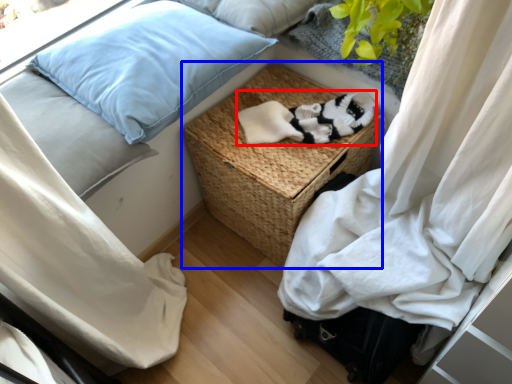
Question: Among these objects, which one is farthest to the camera, clothing (highlighted by a red box) or furniture (highlighted by a blue box)?

Choices:
 (A) clothing
 (B) furniture

Answer: (A)